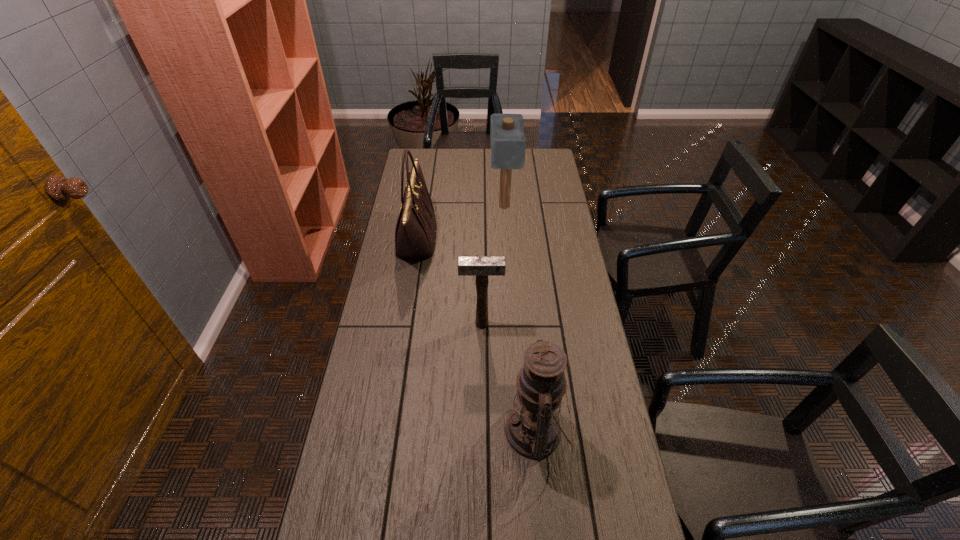
This screenshot has height=540, width=960. Find the location of `the taller mallet`. the taller mallet is located at coordinates (508, 142).

Where is `the leftmost object`? This screenshot has height=540, width=960. the leftmost object is located at coordinates (415, 233).

The height and width of the screenshot is (540, 960). In order to click on the nearest object in this screenshot , I will do `click(532, 429)`.

Identify the location of the nearer mallet. The height and width of the screenshot is (540, 960). (481, 267).

Find the location of a particular element. Image resolution: width=960 pixels, height=540 pixels. the shortest object is located at coordinates (481, 267).

You are a GUI agent. You are given a task and a screenshot of the screen. Output one action in this format:
    pyautogui.click(x=<x>, y=<y>)
    Task: Click on the vacant space located on the front of the taller mallet
    This screenshot has width=960, height=540.
    Given the screenshot: What is the action you would take?
    pyautogui.click(x=507, y=252)

Where is `blank space located 0.190m on the front-facing side of the leftmost object`? Image resolution: width=960 pixels, height=540 pixels. blank space located 0.190m on the front-facing side of the leftmost object is located at coordinates (482, 239).

The height and width of the screenshot is (540, 960). Find the location of `free space located on the left of the oil lamp`. free space located on the left of the oil lamp is located at coordinates (444, 431).

Image resolution: width=960 pixels, height=540 pixels. What are the coordinates of `vacant space located 0.270m on the front of the second nearest object` in the screenshot? It's located at (482, 401).

At what (x,y) coordinates should I click in order to perform the action: click on object that is at the left edge. Please return your answer as a coordinate pair (x, y). Looking at the image, I should click on (415, 233).